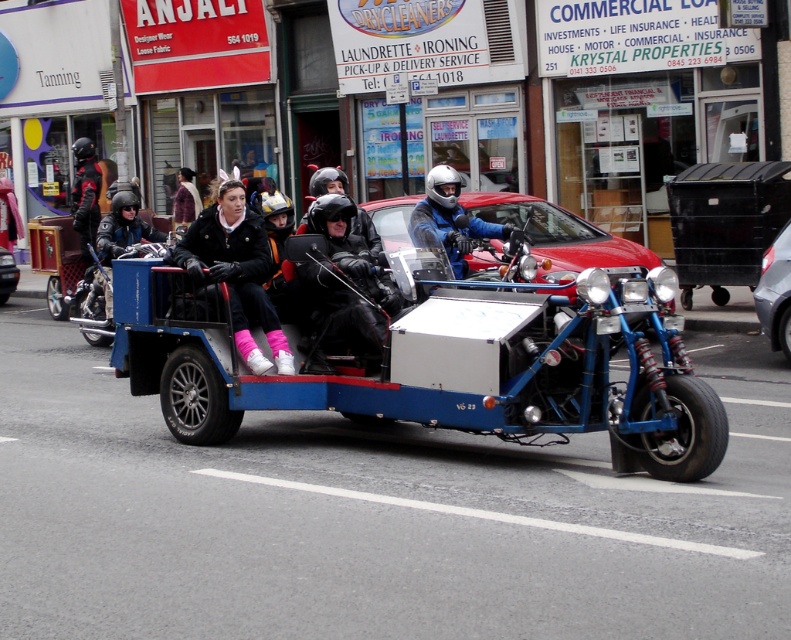
Is point (612, 256) closer to camera compared to point (101, 323)?

Yes, it is.

Can you confirm if red matte car at center is positioned above metallic blue motorcycle at center?

Yes.

Is point (479, 198) behind point (93, 292)?

No.

Where is `red matte car at center`? The height and width of the screenshot is (640, 791). red matte car at center is located at coordinates (559, 234).

Can you confirm if blue metallic sidecar at center is taller than metallic blue motorcycle at center?

Indeed, blue metallic sidecar at center has a greater height compared to metallic blue motorcycle at center.

Who is more forward, (328, 346) or (85, 308)?

Positioned in front is point (328, 346).

Who is more distant from viewer, (214, 371) or (101, 332)?

Point (101, 332)

The image size is (791, 640). I want to click on blue metallic sidecar at center, so click(424, 353).

Which of these two, pink suede boots at center or plush purple coat at center, stands taller?

With more height is pink suede boots at center.

Locate an element on the screen. This screenshot has height=640, width=791. pink suede boots at center is located at coordinates (237, 273).

The width and height of the screenshot is (791, 640). Identify the location of pink suede boots at center. (237, 273).